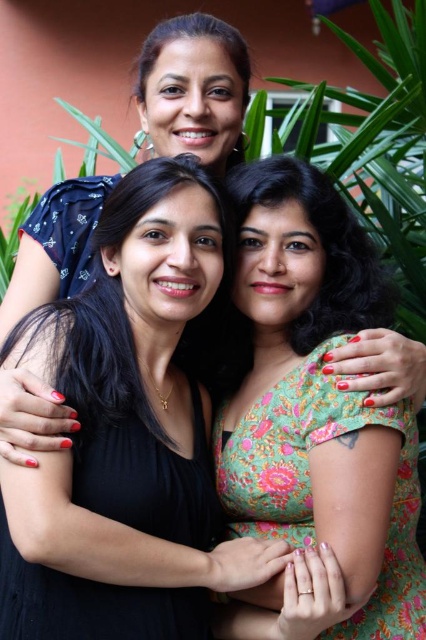
You are a photographer trying to capture a photo of the matte blue dress at upper left and the floral fabric dress at center. Based on their positions, which dress should you focus on first to ensure both are in frame?

The matte blue dress at upper left should be focused on first since it is positioned above the floral fabric dress at center, allowing the photographer to frame both dresses by starting from the higher position.

Looking at this image, you are a photographer standing at a distance. You want to take a portrait of the black matte dress at center. What is the minimum distance you need to be from the dress to ensure it fills the frame properly?

The black matte dress at center is 1.78 meters away from the camera. To ensure it fills the frame properly, the photographer should maintain a distance of at least 1.78 meters.

You are a photographer trying to capture a group photo of the women in the scene. You want to ensure that both the black matte dress at center and the floral fabric dress at center are clearly visible in the frame. Which dress should you position closer to the camera to ensure visibility, considering their current positions?

The black matte dress at center is to the left of the floral fabric dress at center, so positioning the black matte dress at center closer to the camera would ensure both dresses are visible.